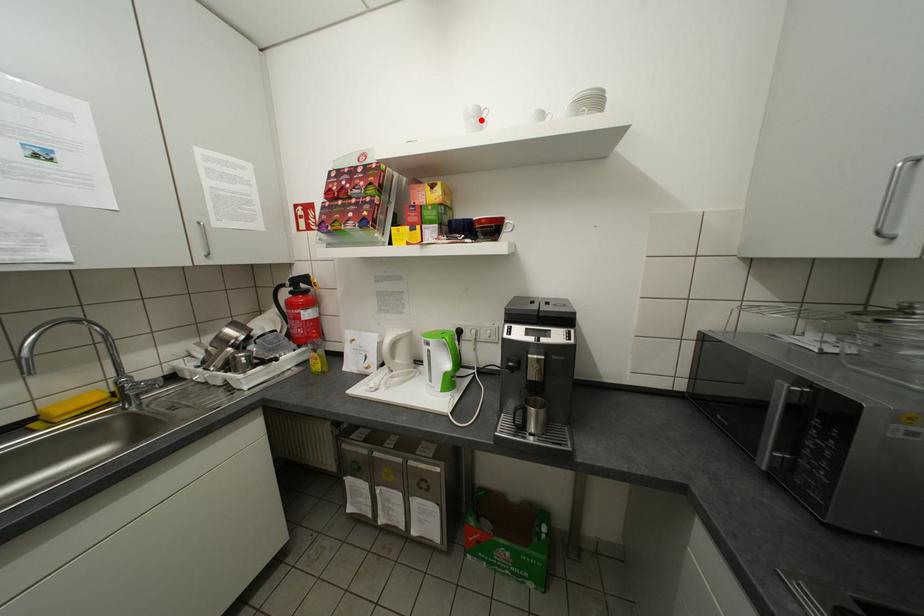
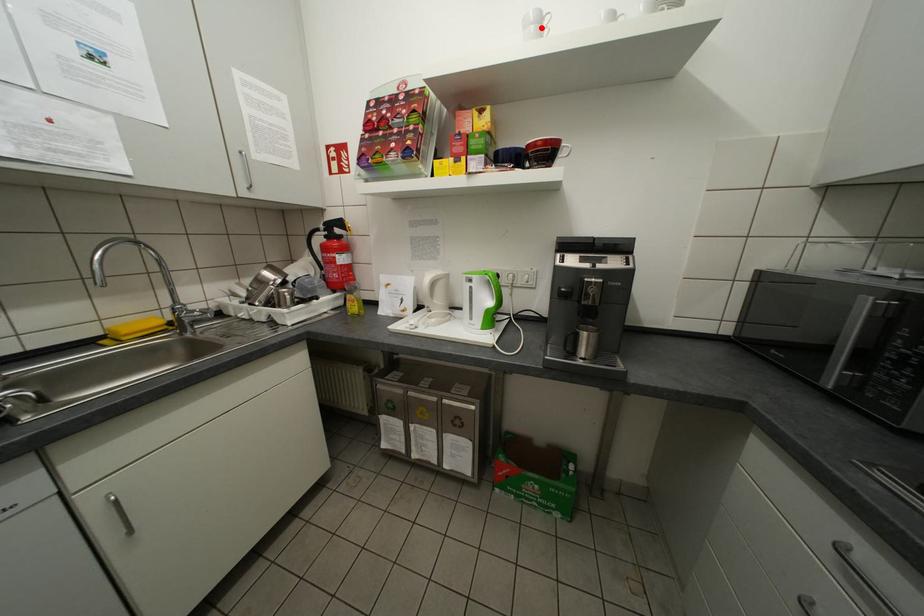
I am providing you with two images of the same scene from different viewpoints. A red point is marked on the first image and another point is marked on the second image. Is the red point in image1 aligned with the point shown in image2?

Yes